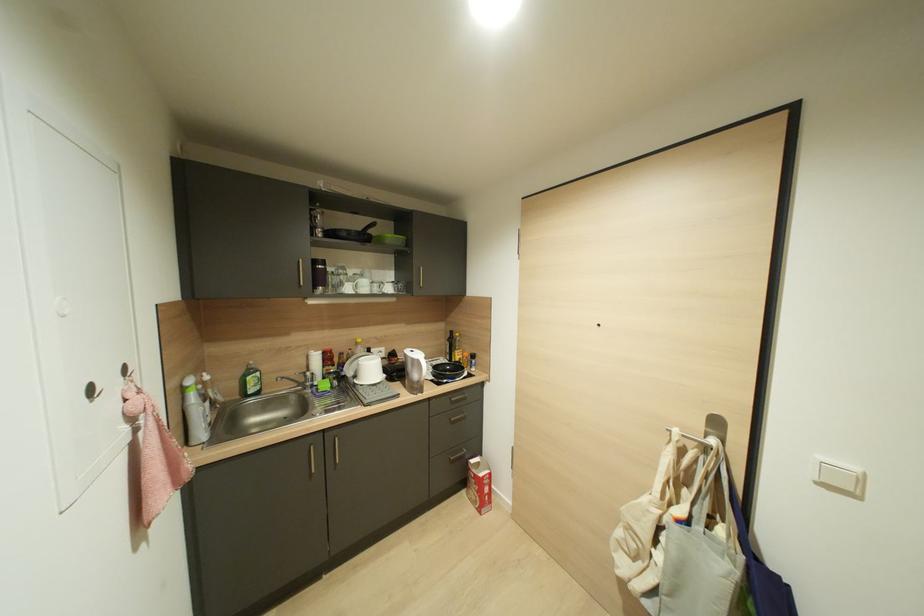
You are a GUI agent. You are given a task and a screenshot of the screen. Output one action in this format:
    pyautogui.click(x=<x>, y=<y>)
    Task: Click on the metal door hook
    This screenshot has width=924, height=616.
    Given the screenshot: What is the action you would take?
    pyautogui.click(x=91, y=391)